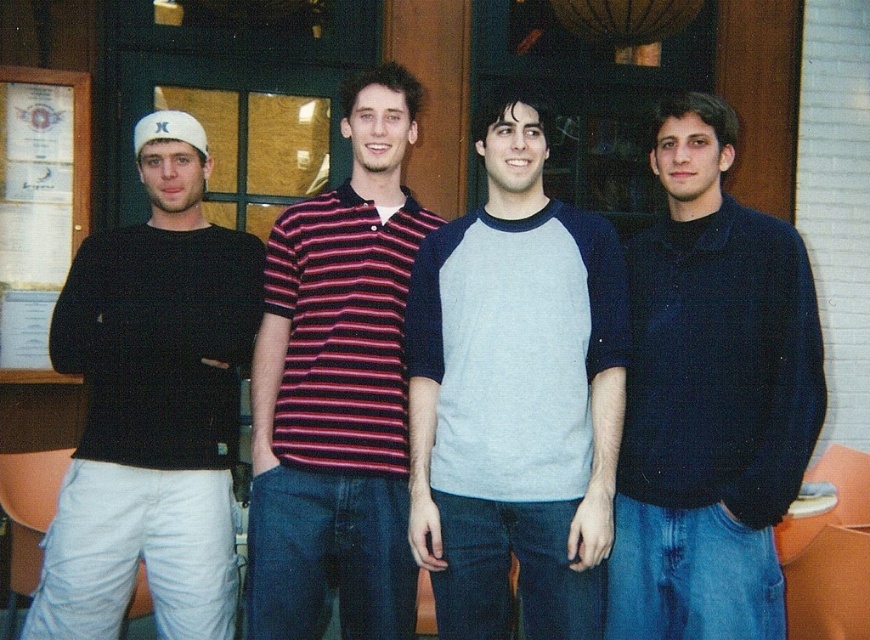
From the picture: Between black matte shirt at left and white paperboard at left, which one has more height?

black matte shirt at left

Is black matte shirt at left to the left of white paperboard at left from the viewer's perspective?

Incorrect, black matte shirt at left is not on the left side of white paperboard at left.

Does point (226, 564) come in front of point (48, 292)?

Yes, it is in front of point (48, 292).

At what (x,y) coordinates should I click in order to perform the action: click on black matte shirt at left. Please return your answer as a coordinate pair (x, y). This screenshot has height=640, width=870. Looking at the image, I should click on (152, 406).

From the picture: Is dark blue polo shirt at right shorter than black matte shirt at left?

Yes.

Identify the location of dark blue polo shirt at right. (710, 397).

Is point (651, 490) closer to viewer compared to point (177, 168)?

Yes, point (651, 490) is in front of point (177, 168).

The width and height of the screenshot is (870, 640). I want to click on dark blue polo shirt at right, so click(710, 397).

Can you confirm if light gray cotton t-shirt at center is positioned to the left of dark blue polo shirt at right?

Yes, light gray cotton t-shirt at center is to the left of dark blue polo shirt at right.

Does light gray cotton t-shirt at center have a lesser width compared to dark blue polo shirt at right?

In fact, light gray cotton t-shirt at center might be wider than dark blue polo shirt at right.

The image size is (870, 640). Find the location of `light gray cotton t-shirt at center`. light gray cotton t-shirt at center is located at coordinates (514, 397).

You are a GUI agent. You are given a task and a screenshot of the screen. Output one action in this format:
    pyautogui.click(x=<x>, y=<y>)
    Task: Click on the light gray cotton t-shirt at center
    
    Given the screenshot: What is the action you would take?
    pyautogui.click(x=514, y=397)